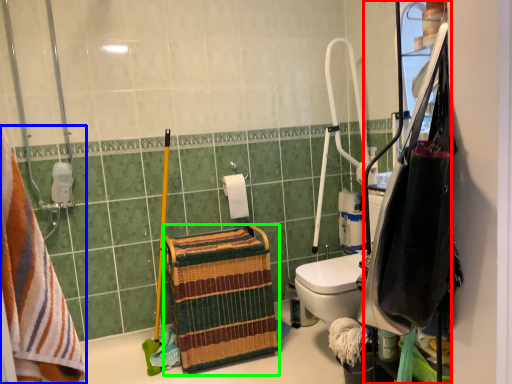
Question: Based on their relative distances, which object is farther from cabinetry (highlighted by a red box)? Choose from towel (highlighted by a blue box) and basket (highlighted by a green box).

Choices:
 (A) towel
 (B) basket

Answer: (B)